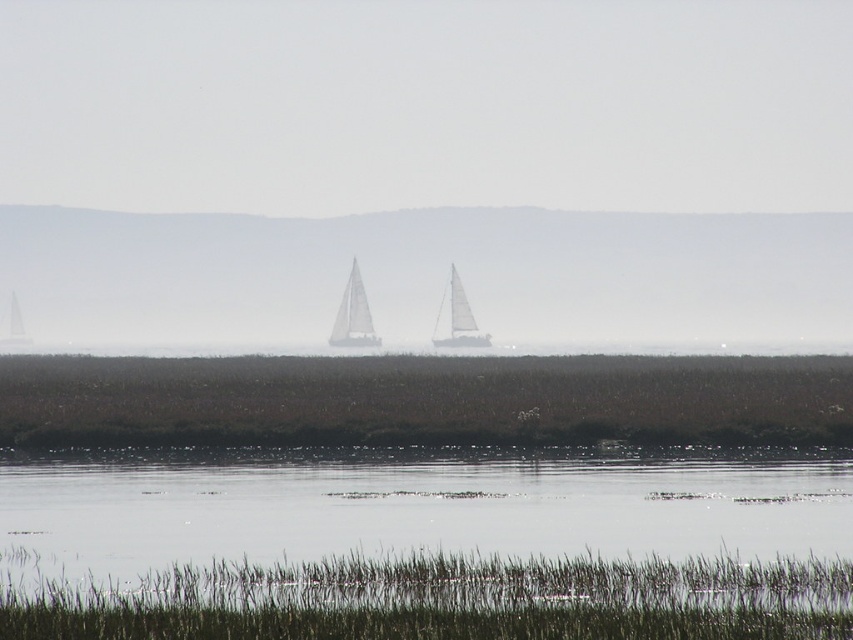
Can you confirm if green grass at lower center is shorter than white matte sailboat at center?

Yes.

Is point (329, 604) behind point (335, 346)?

No, (329, 604) is in front of (335, 346).

Which is in front, point (286, 593) or point (364, 342)?

Point (286, 593)

You are a GUI agent. You are given a task and a screenshot of the screen. Output one action in this format:
    pyautogui.click(x=<x>, y=<y>)
    Task: Click on the green grass at lower center
    The image size is (853, 640).
    Given the screenshot: What is the action you would take?
    pyautogui.click(x=442, y=600)

Can you confirm if brown grass at lower center is shorter than white matte sailboat at center?

Correct, brown grass at lower center is not as tall as white matte sailboat at center.

Which is in front, point (254, 380) or point (364, 308)?

Positioned in front is point (254, 380).

Image resolution: width=853 pixels, height=640 pixels. In order to click on brown grass at lower center in this screenshot , I will do `click(422, 401)`.

Which is above, foggy white sailboats at center or white sailboat at left?

foggy white sailboats at center

Is point (576, 221) closer to camera compared to point (10, 296)?

Yes, it is in front of point (10, 296).

Identify the location of foggy white sailboats at center. Image resolution: width=853 pixels, height=640 pixels. (428, 275).